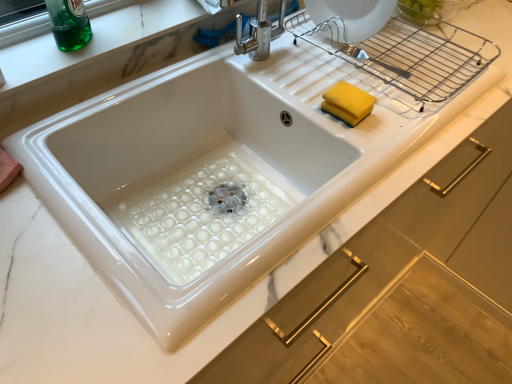
Where is `free location to the right of yellow sponge at upper right`? This screenshot has width=512, height=384. free location to the right of yellow sponge at upper right is located at coordinates (411, 119).